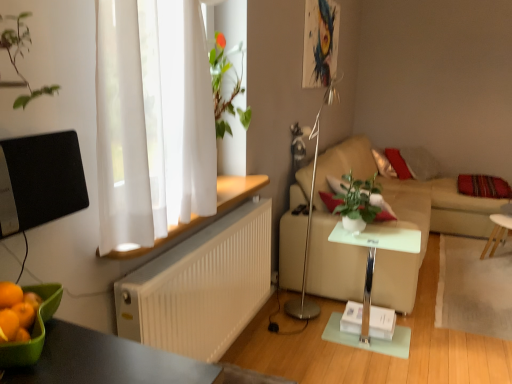
Question: Does white glossy side table at center, marked as the 1th table in a front-to-back arrangement, turn towards silver metallic floor lamp at center?

Choices:
 (A) no
 (B) yes

Answer: (A)

Question: From the image's perspective, is white glossy side table at center, marked as the 2th table in a right-to-left arrangement, over silver metallic floor lamp at center?

Choices:
 (A) no
 (B) yes

Answer: (A)

Question: Is white glossy side table at center, marked as the 2th table in a back-to-front arrangement, turned away from silver metallic floor lamp at center?

Choices:
 (A) yes
 (B) no

Answer: (A)

Question: Is white glossy side table at center, arranged as the 1th table when viewed from the left, to the right of silver metallic floor lamp at center from the viewer's perspective?

Choices:
 (A) no
 (B) yes

Answer: (B)

Question: Can you confirm if white glossy side table at center, marked as the 2th table in a back-to-front arrangement, is shorter than silver metallic floor lamp at center?

Choices:
 (A) no
 (B) yes

Answer: (B)

Question: Visually, is silver metallic floor lamp at center positioned to the left or to the right of white wooden table at right, which ranks as the first table in back-to-front order?

Choices:
 (A) left
 (B) right

Answer: (A)

Question: From a real-world perspective, is silver metallic floor lamp at center physically located above or below white wooden table at right, the 2th table from the left?

Choices:
 (A) below
 (B) above

Answer: (B)

Question: Considering their positions, is silver metallic floor lamp at center located in front of or behind white wooden table at right, which ranks as the first table in back-to-front order?

Choices:
 (A) behind
 (B) front

Answer: (B)

Question: Does point (303, 294) appear closer or farther from the camera than point (506, 231)?

Choices:
 (A) closer
 (B) farther

Answer: (A)

Question: Considering the relative positions of white ribbed radiator at lower left and white glossy side table at center, marked as the 2th table in a right-to-left arrangement, in the image provided, is white ribbed radiator at lower left to the left or to the right of white glossy side table at center, marked as the 2th table in a right-to-left arrangement,?

Choices:
 (A) right
 (B) left

Answer: (B)

Question: In terms of width, does white ribbed radiator at lower left look wider or thinner when compared to white glossy side table at center, marked as the 2th table in a back-to-front arrangement?

Choices:
 (A) thin
 (B) wide

Answer: (A)

Question: In terms of height, does white ribbed radiator at lower left look taller or shorter compared to white glossy side table at center, marked as the 2th table in a right-to-left arrangement?

Choices:
 (A) short
 (B) tall

Answer: (B)

Question: Does point (252, 269) appear closer or farther from the camera than point (380, 324)?

Choices:
 (A) farther
 (B) closer

Answer: (B)

Question: Considering the positions of white ribbed radiator at lower left and green glossy houseplant at center in the image, is white ribbed radiator at lower left wider or thinner than green glossy houseplant at center?

Choices:
 (A) wide
 (B) thin

Answer: (B)

Question: Does point (133, 339) appear closer or farther from the camera than point (374, 201)?

Choices:
 (A) farther
 (B) closer

Answer: (B)